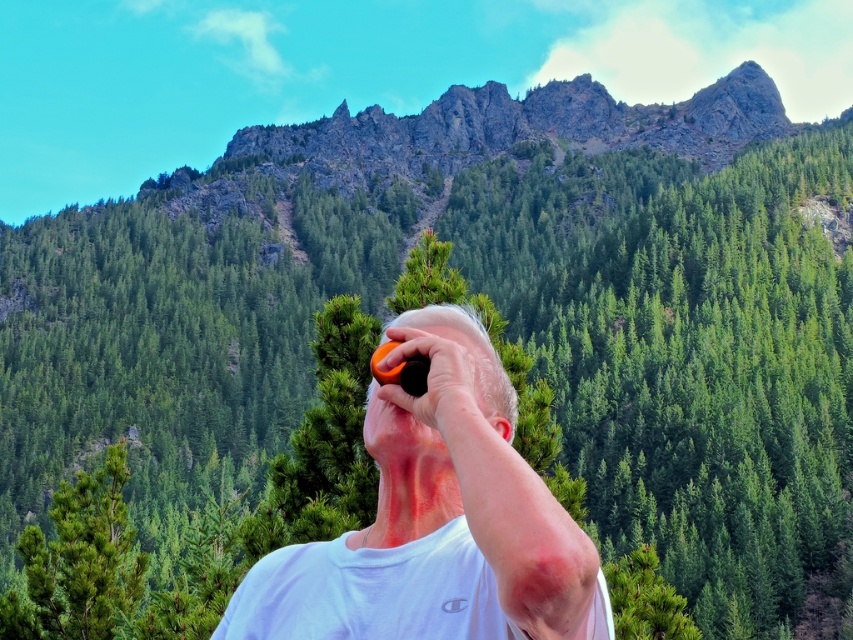
Can you confirm if orange matte camera at center is thinner than orange matte tennis ball at upper center?

No.

Is orange matte camera at center wider than orange matte tennis ball at upper center?

Indeed, orange matte camera at center has a greater width compared to orange matte tennis ball at upper center.

Who is more forward, (403, 465) or (428, 397)?

Point (428, 397) is in front.

Identify the location of orange matte camera at center. click(x=436, y=522).